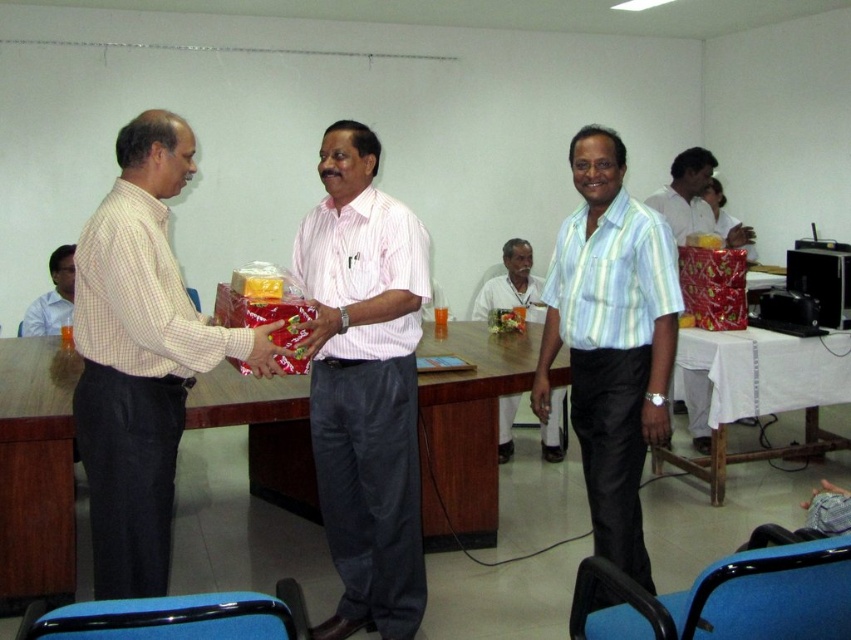
You are a photographer in the scene and want to capture a photo where the light blue striped shirt at center and the white fabric shirt at center are both visible. Based on their positions, which shirt should you ensure is closer to the camera to include both in the frame?

The light blue striped shirt at center is below the white fabric shirt at center, so to include both in the frame, you should ensure the white fabric shirt at center is closer to the camera.

Looking at this image, you are a photographer trying to capture a group photo of the three men. You notice the light blue striped shirt at center and the shiny metallic gift at right. Which object takes up more space in the photo?

The shiny metallic gift at right takes up more space in the photo because it has a greater width than the light blue striped shirt at center.